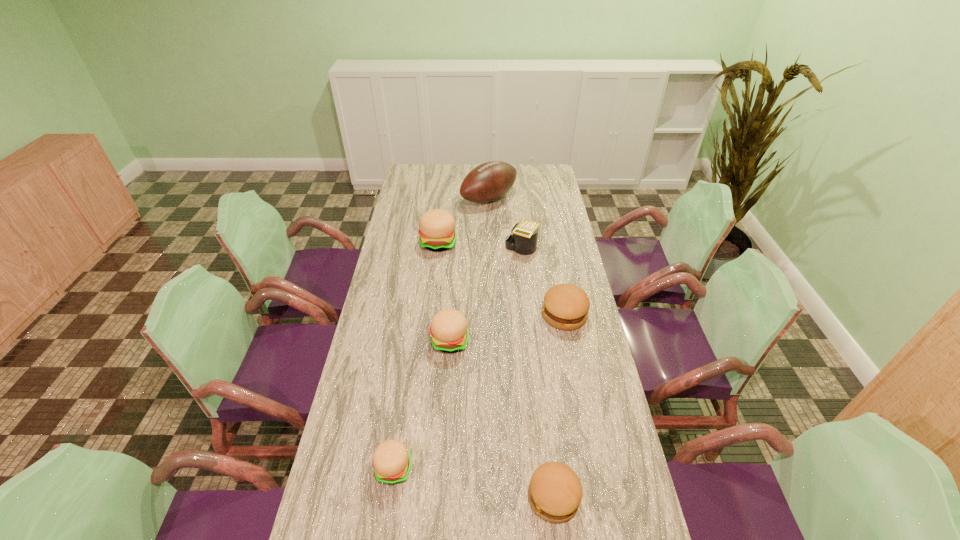
The height and width of the screenshot is (540, 960). I want to click on hamburger that is the second closest to the smaller brown hamburger, so click(x=449, y=333).

Identify which hamburger is the fourth nearest to the tallest hamburger. Please provide its 2D coordinates. Your answer should be formatted as a tuple, i.e. [(x, y)], where the tuple contains the x and y coordinates of a point satisfying the conditions above.

[(555, 491)]

The image size is (960, 540). Identify the location of beige hamburger that stands as the second closest to the tallest object. (449, 333).

The width and height of the screenshot is (960, 540). What are the coordinates of `beige hamburger identified as the second closest to the calculator` in the screenshot? It's located at (449, 333).

In order to click on the second closest brown hamburger relative to the calculator in this screenshot , I will do `click(555, 491)`.

The width and height of the screenshot is (960, 540). In order to click on free spot that satisfies the following two spatial constraints: 1. on the back side of the second biggest beige hamburger; 2. on the left side of the calculator in this screenshot , I will do `click(456, 248)`.

Find the location of a particular element. The height and width of the screenshot is (540, 960). vacant point that satisfies the following two spatial constraints: 1. on the front side of the brown football (American); 2. on the left side of the bigger brown hamburger is located at coordinates (492, 315).

Where is `free spot that satisfies the following two spatial constraints: 1. on the front side of the smallest beige hamburger; 2. on the right side of the nearer brown hamburger`? This screenshot has height=540, width=960. free spot that satisfies the following two spatial constraints: 1. on the front side of the smallest beige hamburger; 2. on the right side of the nearer brown hamburger is located at coordinates (390, 497).